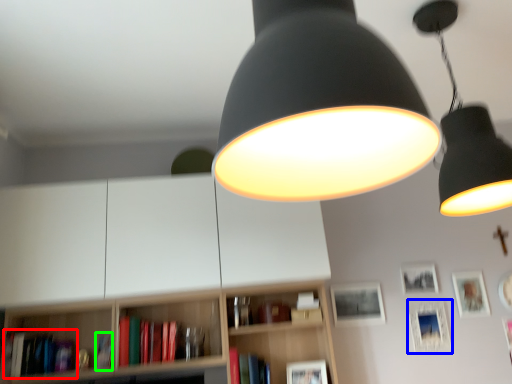
Question: Which is nearer to the book (highlighted by a red box)? picture frame (highlighted by a blue box) or book (highlighted by a green box).

Choices:
 (A) picture frame
 (B) book

Answer: (B)